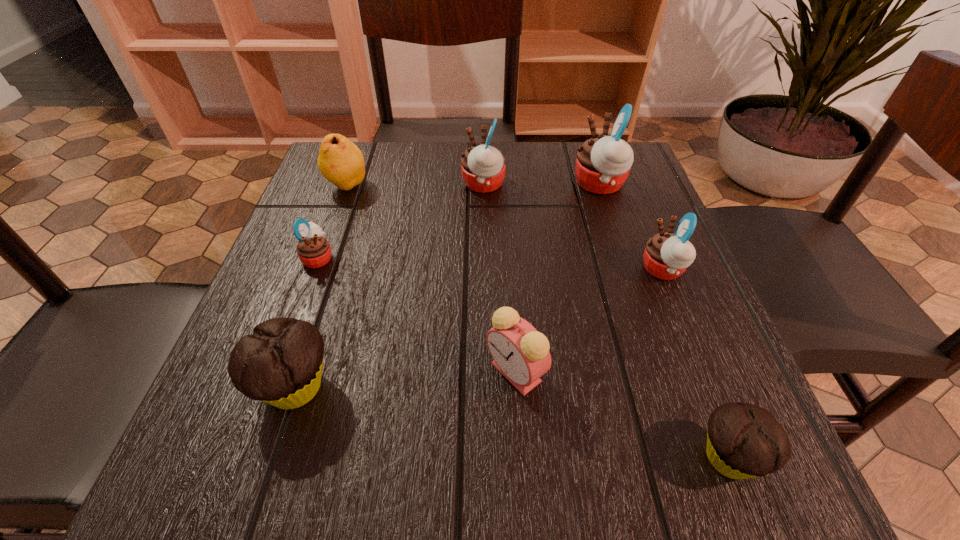
The width and height of the screenshot is (960, 540). Identify the location of vacant space located on the face of the alarm clock. (222, 373).

Locate an element on the screen. The width and height of the screenshot is (960, 540). free location located 0.370m on the face of the alarm clock is located at coordinates (235, 373).

Image resolution: width=960 pixels, height=540 pixels. In order to click on free space located on the face of the alarm clock in this screenshot , I will do `click(330, 373)`.

I want to click on free space located 0.050m on the front of the left chocolate muffin, so click(269, 467).

Find the location of a particular element. This screenshot has height=540, width=960. free space located 0.380m on the front-facing side of the leftmost pink muffin is located at coordinates (538, 258).

I want to click on vacant point located on the left of the smaller chocolate muffin, so click(474, 457).

This screenshot has width=960, height=540. What are the coordinates of `pear at the far edge` in the screenshot? It's located at (340, 161).

The height and width of the screenshot is (540, 960). I want to click on object present at the near edge, so click(744, 441).

Locate an element on the screen. The height and width of the screenshot is (540, 960). pear that is at the left edge is located at coordinates (340, 161).

Locate an element on the screen. The height and width of the screenshot is (540, 960). object situated at the far left corner is located at coordinates (340, 161).